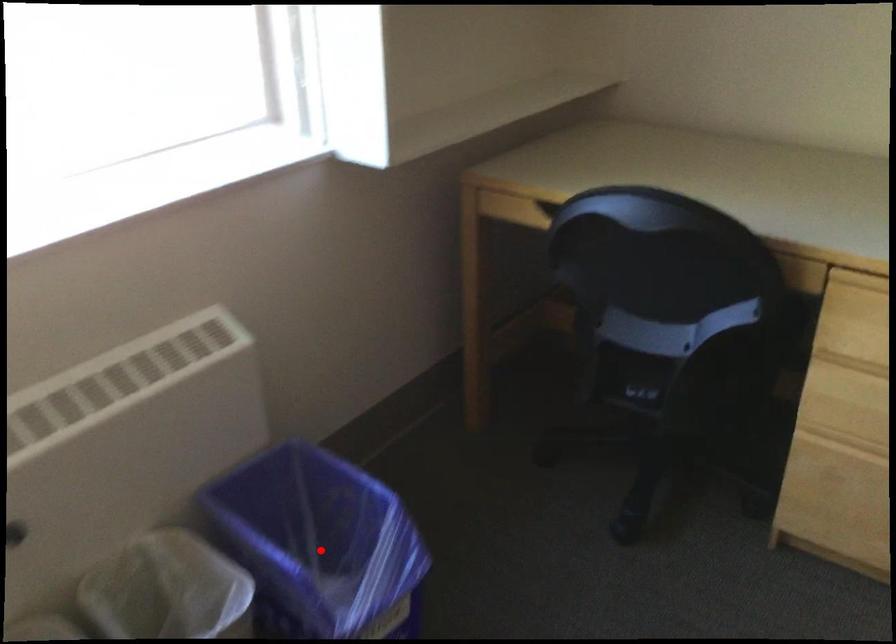
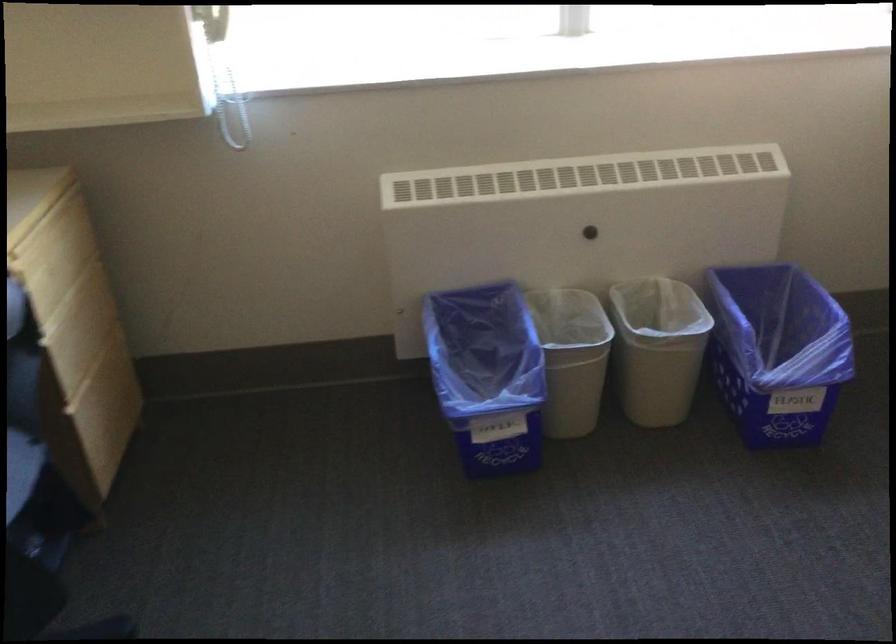
Question: I am providing you with two images of the same scene from different viewpoints. A red point is marked on the first image. At the location where the point appears in image 1, is it still visible in image 2?

Choices:
 (A) Yes
 (B) No

Answer: (A)